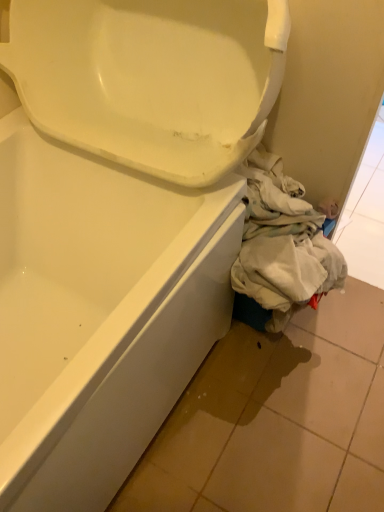
Question: From a real-world perspective, is light beige fabric at lower right above or below matte white tile at lower right?

Choices:
 (A) above
 (B) below

Answer: (A)

Question: In the image, is light beige fabric at lower right on the left side or the right side of matte white tile at lower right?

Choices:
 (A) left
 (B) right

Answer: (A)

Question: Looking at their shapes, would you say light beige fabric at lower right is wider or thinner than matte white tile at lower right?

Choices:
 (A) thin
 (B) wide

Answer: (A)

Question: Is matte white tile at lower right bigger or smaller than light beige fabric at lower right?

Choices:
 (A) big
 (B) small

Answer: (A)

Question: Relative to light beige fabric at lower right, is matte white tile at lower right in front or behind?

Choices:
 (A) front
 (B) behind

Answer: (A)

Question: Visually, is matte white tile at lower right positioned to the left or to the right of light beige fabric at lower right?

Choices:
 (A) left
 (B) right

Answer: (B)

Question: In terms of height, does matte white tile at lower right look taller or shorter compared to light beige fabric at lower right?

Choices:
 (A) short
 (B) tall

Answer: (A)